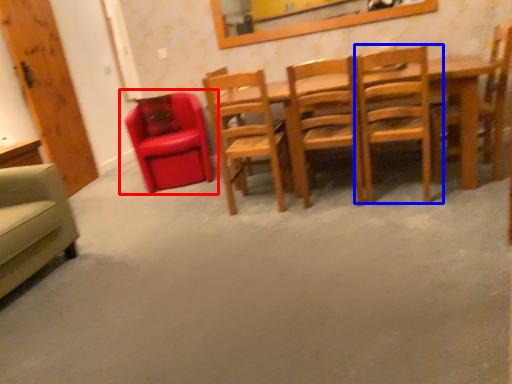
Question: Which point is closer to the camera, chair (highlighted by a red box) or chair (highlighted by a blue box)?

Choices:
 (A) chair
 (B) chair

Answer: (B)